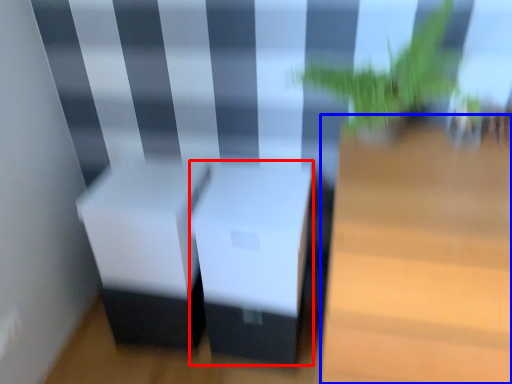
Question: Which object is further to the camera taking this photo, table (highlighted by a red box) or table (highlighted by a blue box)?

Choices:
 (A) table
 (B) table

Answer: (A)